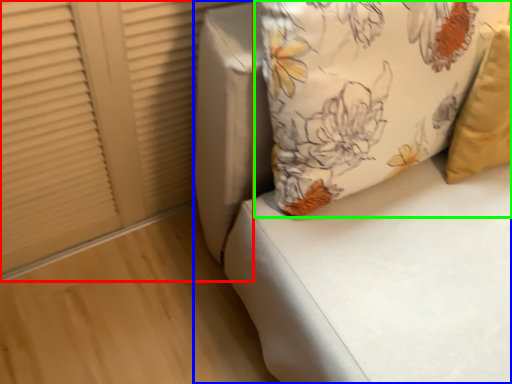
Question: Considering the real-world distances, which object is closest to shutter (highlighted by a red box)? furniture (highlighted by a blue box) or pillow (highlighted by a green box).

Choices:
 (A) furniture
 (B) pillow

Answer: (A)